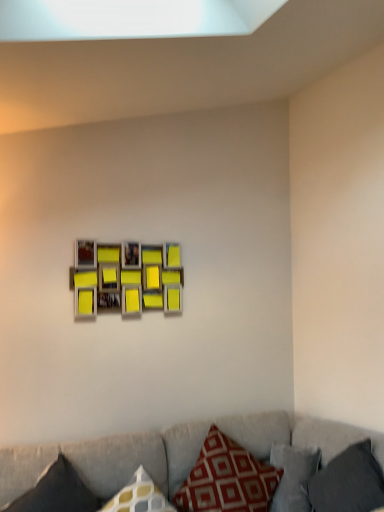
Question: Can you confirm if matte yellow picture frame at center is smaller than red printed cushion at lower center, placed as the second pillow when sorted from right to left?

Choices:
 (A) no
 (B) yes

Answer: (B)

Question: Is matte yellow picture frame at center outside of red printed cushion at lower center, placed as the second pillow when sorted from right to left?

Choices:
 (A) no
 (B) yes

Answer: (B)

Question: Is matte yellow picture frame at center positioned before red printed cushion at lower center, the 2th pillow from the left?

Choices:
 (A) yes
 (B) no

Answer: (B)

Question: Can you confirm if matte yellow picture frame at center is positioned to the right of red printed cushion at lower center, placed as the second pillow when sorted from right to left?

Choices:
 (A) yes
 (B) no

Answer: (B)

Question: From a real-world perspective, is matte yellow picture frame at center positioned over red printed cushion at lower center, placed as the second pillow when sorted from right to left, based on gravity?

Choices:
 (A) no
 (B) yes

Answer: (B)

Question: Can you confirm if matte yellow picture frame at center is wider than red printed cushion at lower center, placed as the second pillow when sorted from right to left?

Choices:
 (A) yes
 (B) no

Answer: (B)

Question: From a real-world perspective, is dark gray fabric pillow at lower right, the 1th pillow in the right-to-left sequence, under matte yellow picture frame at center?

Choices:
 (A) yes
 (B) no

Answer: (A)

Question: Is dark gray fabric pillow at lower right, the 1th pillow in the right-to-left sequence, to the right of matte yellow picture frame at center from the viewer's perspective?

Choices:
 (A) no
 (B) yes

Answer: (B)

Question: Does dark gray fabric pillow at lower right, arranged as the third pillow when viewed from the left, turn towards matte yellow picture frame at center?

Choices:
 (A) no
 (B) yes

Answer: (A)

Question: Is dark gray fabric pillow at lower right, arranged as the third pillow when viewed from the left, positioned beyond the bounds of matte yellow picture frame at center?

Choices:
 (A) yes
 (B) no

Answer: (A)

Question: Does dark gray fabric pillow at lower right, the 1th pillow in the right-to-left sequence, have a lesser height compared to matte yellow picture frame at center?

Choices:
 (A) no
 (B) yes

Answer: (B)

Question: From the image's perspective, would you say dark gray fabric pillow at lower right, arranged as the third pillow when viewed from the left, is positioned over matte yellow picture frame at center?

Choices:
 (A) no
 (B) yes

Answer: (A)

Question: From a real-world perspective, does matte yellow picture frame at center stand above textured gray couch at lower center?

Choices:
 (A) yes
 (B) no

Answer: (A)